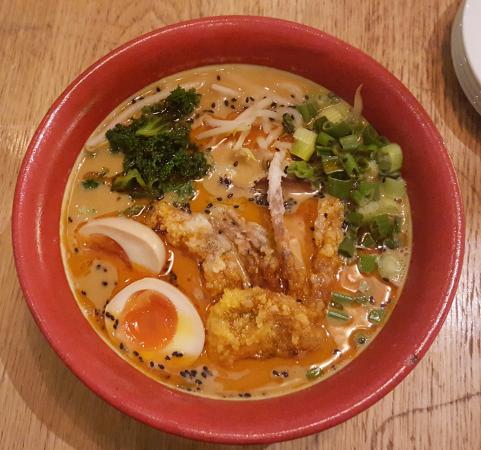
The width and height of the screenshot is (481, 450). I want to click on red bowl, so click(x=46, y=277), click(x=291, y=407), click(x=434, y=198), click(x=218, y=48).